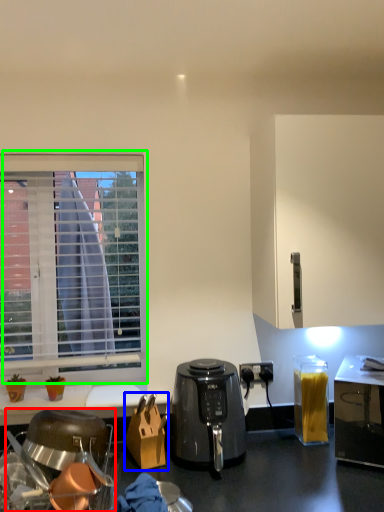
Question: Considering the real-world distances, which object is farthest from kitchen appliance (highlighted by a red box)? cardboard box (highlighted by a blue box) or window (highlighted by a green box)?

Choices:
 (A) cardboard box
 (B) window

Answer: (B)